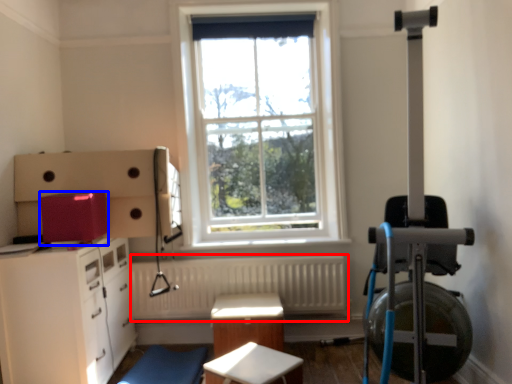
Question: Which object is further to the camera taking this photo, radiator (highlighted by a red box) or appliance (highlighted by a blue box)?

Choices:
 (A) radiator
 (B) appliance

Answer: (A)